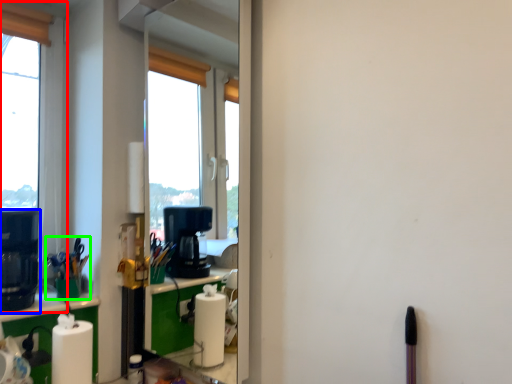
Question: Which is farther away from window (highlighted by a red box)? coffee machine (highlighted by a blue box) or stationery (highlighted by a green box)?

Choices:
 (A) coffee machine
 (B) stationery

Answer: (B)